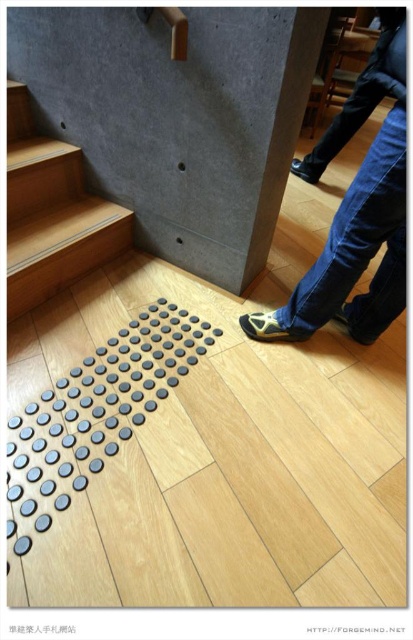
Question: From the image, what is the correct spatial relationship of denim jeans at lower right in relation to wooden at left?

Choices:
 (A) left
 (B) right

Answer: (B)

Question: Which point is farther to the camera?

Choices:
 (A) (367, 106)
 (B) (18, 292)

Answer: (A)

Question: Which object is closer to the camera taking this photo?

Choices:
 (A) denim jeans at lower right
 (B) wooden at left

Answer: (A)

Question: Which of the following is the farthest from the observer?

Choices:
 (A) (400, 13)
 (B) (42, 240)

Answer: (B)

Question: Does denim jeans at lower right have a smaller size compared to wooden at left?

Choices:
 (A) no
 (B) yes

Answer: (A)

Question: Where is denim jeans at lower right located in relation to wooden at left in the image?

Choices:
 (A) left
 (B) right

Answer: (B)